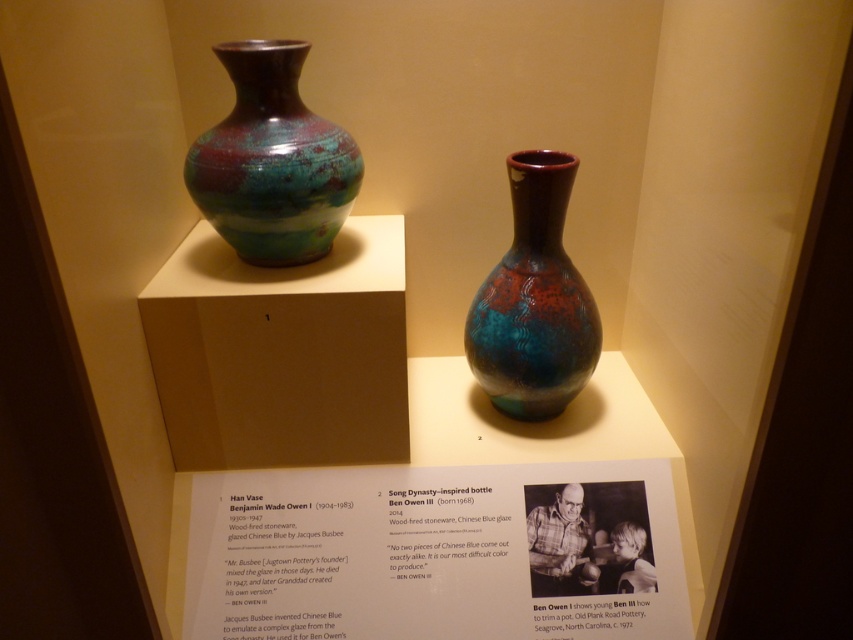
Question: Can you confirm if matte glazed vase at center is positioned to the right of teal-glazed stoneware vase at center?

Choices:
 (A) yes
 (B) no

Answer: (B)

Question: Can you confirm if matte glazed vase at center is bigger than teal-glazed stoneware vase at center?

Choices:
 (A) no
 (B) yes

Answer: (A)

Question: Where is matte glazed vase at center located in relation to teal-glazed stoneware vase at center in the image?

Choices:
 (A) above
 (B) below

Answer: (A)